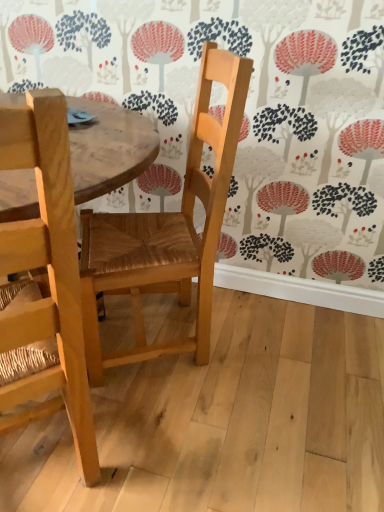
Question: Should I look upward or downward to see natural wood chair at center, the first chair from the right?

Choices:
 (A) down
 (B) up

Answer: (B)

Question: Is natural wood chair at center, the first chair from the right, directly adjacent to natural wood chair at center, which is counted as the second chair, starting from the right?

Choices:
 (A) yes
 (B) no

Answer: (B)

Question: Does natural wood chair at center, the first chair from the right, appear on the left side of natural wood chair at center, the 1th chair in the left-to-right sequence?

Choices:
 (A) yes
 (B) no

Answer: (B)

Question: From the image's perspective, would you say natural wood chair at center, the second chair positioned from the left, is positioned over natural wood chair at center, the 1th chair in the left-to-right sequence?

Choices:
 (A) no
 (B) yes

Answer: (B)

Question: Does natural wood chair at center, the second chair positioned from the left, appear on the right side of natural wood chair at center, the 1th chair in the left-to-right sequence?

Choices:
 (A) yes
 (B) no

Answer: (A)

Question: From a real-world perspective, is natural wood chair at center, the second chair positioned from the left, located beneath natural wood chair at center, which is counted as the second chair, starting from the right?

Choices:
 (A) no
 (B) yes

Answer: (A)

Question: Is natural wood chair at center, the second chair positioned from the left, bigger than natural wood chair at center, the 1th chair in the left-to-right sequence?

Choices:
 (A) no
 (B) yes

Answer: (B)

Question: Is natural wood chair at center, which is counted as the second chair, starting from the right, completely or partially outside of natural wood chair at center, the second chair positioned from the left?

Choices:
 (A) no
 (B) yes

Answer: (B)

Question: From the image's perspective, is natural wood chair at center, which is counted as the second chair, starting from the right, below natural wood chair at center, the second chair positioned from the left?

Choices:
 (A) no
 (B) yes

Answer: (B)

Question: Does natural wood chair at center, which is counted as the second chair, starting from the right, have a lesser height compared to natural wood chair at center, the second chair positioned from the left?

Choices:
 (A) yes
 (B) no

Answer: (B)

Question: Can natural wood chair at center, the second chair positioned from the left, be found inside natural wood chair at center, which is counted as the second chair, starting from the right?

Choices:
 (A) yes
 (B) no

Answer: (B)

Question: Is natural wood chair at center, which is counted as the second chair, starting from the right, taller than natural wood chair at center, the second chair positioned from the left?

Choices:
 (A) no
 (B) yes

Answer: (B)

Question: Is natural wood chair at center, which is counted as the second chair, starting from the right, thinner than natural wood chair at center, the second chair positioned from the left?

Choices:
 (A) yes
 (B) no

Answer: (B)

Question: From the image's perspective, is natural wood chair at center, the 1th chair in the left-to-right sequence, located above or below natural wood chair at center, the second chair positioned from the left?

Choices:
 (A) above
 (B) below

Answer: (B)